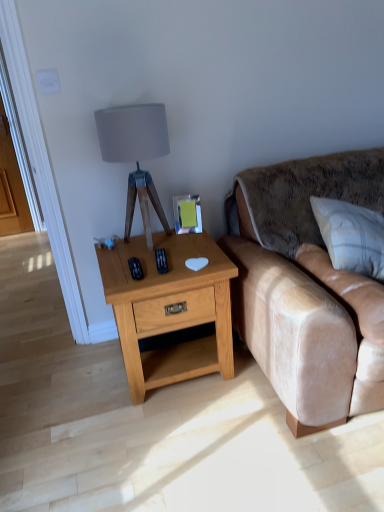
The height and width of the screenshot is (512, 384). I want to click on free space in front of light oak wood nightstand at center, so click(182, 442).